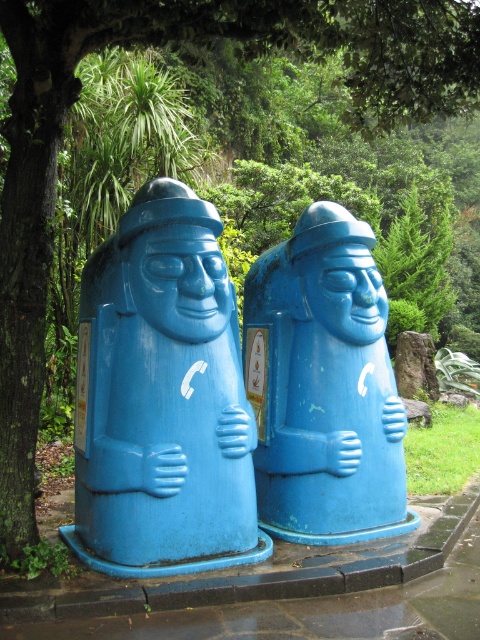
You are standing in a park and want to make a phone call using the blue matte phone booth at center. If your reach extends up to 1.8 meters, can you comfortably use the phone without needing to move closer?

The blue matte phone booth at center is 3.87 meters away from you. Since your reach is only up to 1.8 meters, you would need to move closer to comfortably use the phone.

You are a park visitor who wants to take a photo of both the blue matte phone booth at center and the blue matte sculpture at center. Since you can only focus on one object at a time, which one should you aim your camera at first to ensure the other is still in the background?

The blue matte sculpture at center is located below the blue matte phone booth at center. Since the sculpture is lower, you should focus on the phone booth first, and the sculpture will naturally be in the background behind it.

You are standing in a park and want to take a photo of both the blue matte phone booth at center and the blue matte sculpture at center. Which object should you focus on first to ensure both are in the frame?

You should focus on the blue matte phone booth at center first because it is closer to you than the blue matte sculpture at center, so adjusting the camera to include both would require starting with the closer object.